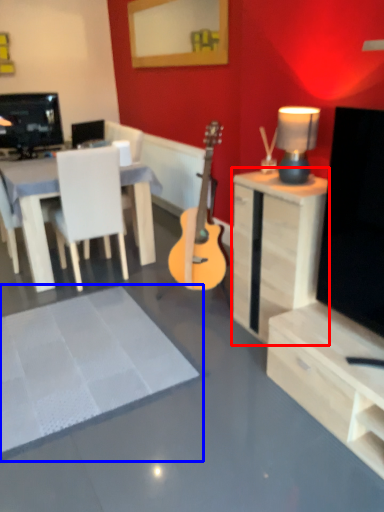
Question: Which object appears farthest to the camera in this image, desk (highlighted by a red box) or flat (highlighted by a blue box)?

Choices:
 (A) desk
 (B) flat

Answer: (A)